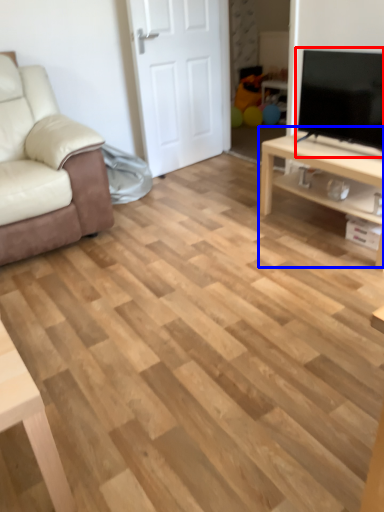
Question: Which point is further to the camera, television (highlighted by a red box) or table (highlighted by a blue box)?

Choices:
 (A) television
 (B) table

Answer: (B)